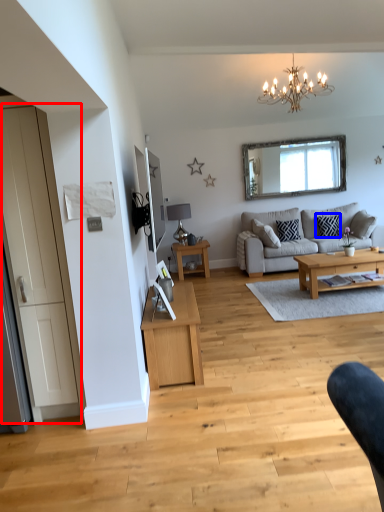
Question: Which point is further to the camera, door (highlighted by a red box) or pillow (highlighted by a blue box)?

Choices:
 (A) door
 (B) pillow

Answer: (B)